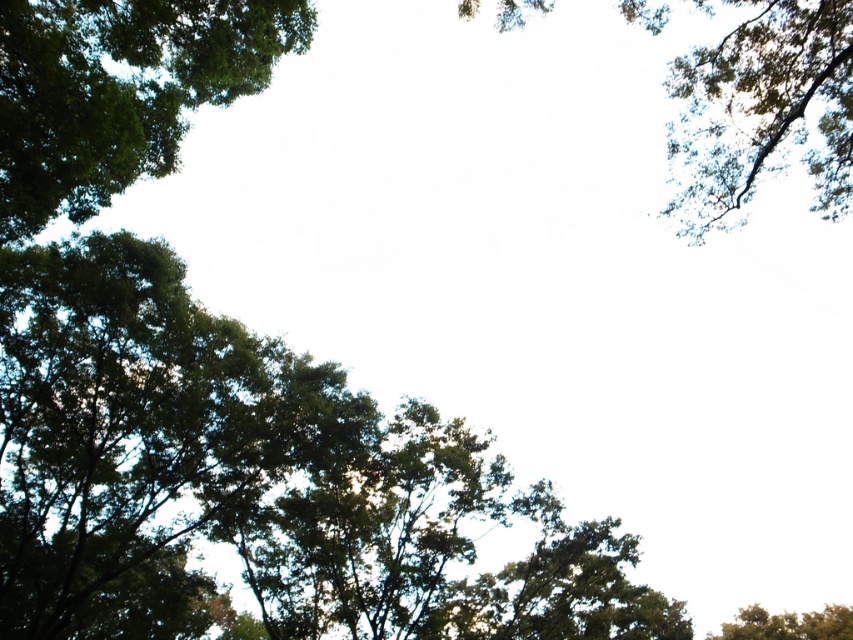
Which of these two, green leafy tree at left or green leafy tree at upper right, stands taller?

green leafy tree at left

Does green leafy tree at left come behind green leafy tree at upper right?

Yes, it is.

Is point (45, 390) farther from camera compared to point (845, 12)?

That is True.

Find the location of a particular element. The height and width of the screenshot is (640, 853). green leafy tree at left is located at coordinates click(137, 435).

Is green leafy tree at upper left smaller than green leafy tree at upper right?

Actually, green leafy tree at upper left might be larger than green leafy tree at upper right.

Identify the location of green leafy tree at upper left. (119, 90).

Is green leafy tree at left smaller than green leafy tree at upper left?

No, green leafy tree at left is not smaller than green leafy tree at upper left.

Where is `green leafy tree at left`? green leafy tree at left is located at coordinates coord(137,435).

Image resolution: width=853 pixels, height=640 pixels. Find the location of `green leafy tree at left`. green leafy tree at left is located at coordinates (137, 435).